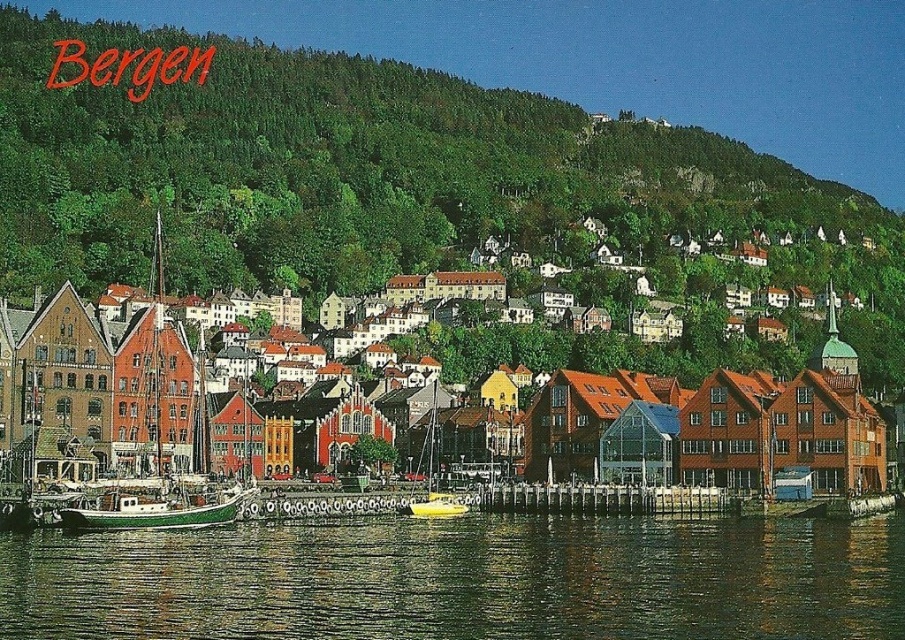
Can you confirm if green forested hillside at upper center is shorter than green reflective water at lower center?

No, green forested hillside at upper center is not shorter than green reflective water at lower center.

Does point (132, 157) lie behind point (294, 602)?

Yes, point (132, 157) is behind point (294, 602).

Who is more forward, (331,182) or (187,630)?

Point (187,630)

The height and width of the screenshot is (640, 905). Find the location of `green forested hillside at upper center`. green forested hillside at upper center is located at coordinates (341, 170).

Who is higher up, green matte boat at lower left or yellow matte sailboat at center?

green matte boat at lower left is higher up.

Between point (164, 365) and point (454, 515), which one is positioned in front?

Point (454, 515) is more forward.

Where is `green matte boat at lower left`? The height and width of the screenshot is (640, 905). green matte boat at lower left is located at coordinates (157, 380).

Is point (603, 198) positioned in front of point (455, 515)?

That is False.

Can you confirm if green forested hillside at upper center is positioned to the right of yellow matte sailboat at center?

Yes, green forested hillside at upper center is to the right of yellow matte sailboat at center.

Which is in front, point (894, 240) or point (431, 474)?

Point (431, 474) is in front.

Identify the location of green forested hillside at upper center. (341, 170).